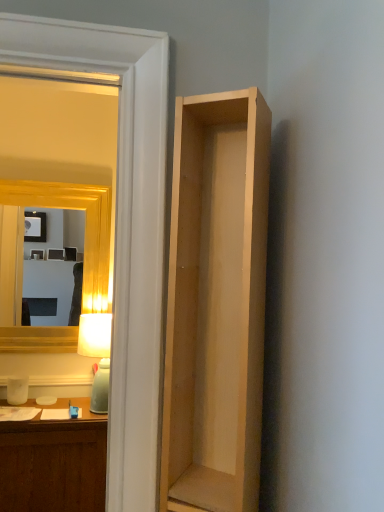
Identify the location of natural wood shelf at right. (216, 304).

From a real-world perspective, is matte white lamp at left under natural wood shelf at right?

Yes, from a real-world perspective, matte white lamp at left is below natural wood shelf at right.

Is the position of matte white lamp at left more distant than that of natural wood shelf at right?

Yes, matte white lamp at left is further from the camera.

Find the location of a particular element. Image resolution: width=384 pixels, height=512 pixels. cabinetry in front of the matte white lamp at left is located at coordinates (216, 304).

Which of these two, matte white lamp at left or natural wood shelf at right, is wider?

matte white lamp at left is wider.

From the image's perspective, is matte white lamp at left located above transparent glass door at upper left?

No, from the image's perspective, matte white lamp at left is not over transparent glass door at upper left.

Is point (107, 339) positioned after point (130, 349)?

Yes, it is behind point (130, 349).

Considering the relative sizes of matte white lamp at left and transparent glass door at upper left in the image provided, is matte white lamp at left bigger than transparent glass door at upper left?

No.

From their relative heights in the image, would you say matte white lamp at left is taller or shorter than transparent glass door at upper left?

Considering their sizes, matte white lamp at left has less height than transparent glass door at upper left.

From the image's perspective, is natural wood shelf at right below gold wooden mirror at upper left?

Indeed, from the image's perspective, natural wood shelf at right is shown beneath gold wooden mirror at upper left.

In the scene shown: From a real-world perspective, who is located lower, natural wood shelf at right or gold wooden mirror at upper left?

natural wood shelf at right, from a real-world perspective.

Considering the sizes of natural wood shelf at right and gold wooden mirror at upper left in the image, is natural wood shelf at right taller or shorter than gold wooden mirror at upper left?

natural wood shelf at right is shorter than gold wooden mirror at upper left.

Identify the location of mirror located above the natural wood shelf at right (from the image's perspective). click(56, 191).

Would you say matte white lamp at left is inside or outside gold wooden mirror at upper left?

matte white lamp at left lies outside gold wooden mirror at upper left.

Is matte white lamp at left taller than gold wooden mirror at upper left?

In fact, matte white lamp at left may be shorter than gold wooden mirror at upper left.

Is matte white lamp at left to the right of gold wooden mirror at upper left from the viewer's perspective?

Yes, matte white lamp at left is to the right of gold wooden mirror at upper left.

From a real-world perspective, which is physically above, gold wooden mirror at upper left or matte white lamp at left?

gold wooden mirror at upper left, from a real-world perspective.

Where is `mirror lying behind the matte white lamp at left`? The width and height of the screenshot is (384, 512). mirror lying behind the matte white lamp at left is located at coordinates (56, 191).

Does gold wooden mirror at upper left touch matte white lamp at left?

gold wooden mirror at upper left and matte white lamp at left are not in contact.

Which object is further away from the camera taking this photo, gold wooden mirror at upper left or matte white lamp at left?

Positioned behind is gold wooden mirror at upper left.

Is transparent glass door at upper left not near matte white lamp at left?

Yes, transparent glass door at upper left and matte white lamp at left are quite far apart.

From a real-world perspective, which is physically above, transparent glass door at upper left or matte white lamp at left?

transparent glass door at upper left, from a real-world perspective.

Which is more distant, (131, 390) or (91, 328)?

The point (91, 328) is farther from the camera.

Would you say transparent glass door at upper left is inside or outside natural wood shelf at right?

transparent glass door at upper left is not enclosed by natural wood shelf at right.

Does transparent glass door at upper left have a greater height compared to natural wood shelf at right?

Yes, transparent glass door at upper left is taller than natural wood shelf at right.

Consider the image. In terms of width, does transparent glass door at upper left look wider or thinner when compared to natural wood shelf at right?

In the image, transparent glass door at upper left appears to be more narrow than natural wood shelf at right.

There is a matte white lamp at left. Identify the location of cabinetry above it (from a real-world perspective). click(x=216, y=304).

The width and height of the screenshot is (384, 512). I want to click on glass door located above the matte white lamp at left (from the image's perspective), so click(x=122, y=225).

From the picture: Looking at the image, which one is located further to natural wood shelf at right, matte white lamp at left or transparent glass door at upper left?

The object further to natural wood shelf at right is matte white lamp at left.

When comparing their distances from transparent glass door at upper left, does natural wood shelf at right or gold wooden mirror at upper left seem closer?

Among the two, natural wood shelf at right is located nearer to transparent glass door at upper left.

Consider the image. When comparing their distances from gold wooden mirror at upper left, does natural wood shelf at right or matte white lamp at left seem further?

natural wood shelf at right is further to gold wooden mirror at upper left.

In the scene shown: Based on their spatial positions, is gold wooden mirror at upper left or transparent glass door at upper left closer to matte white lamp at left?

gold wooden mirror at upper left is positioned closer to the anchor matte white lamp at left.

Estimate the real-world distances between objects in this image. Which object is further from gold wooden mirror at upper left, matte white lamp at left or natural wood shelf at right?

The object further to gold wooden mirror at upper left is natural wood shelf at right.

From the image, which object appears to be nearer to transparent glass door at upper left, natural wood shelf at right or matte white lamp at left?

Among the two, natural wood shelf at right is located nearer to transparent glass door at upper left.

From the image, which object appears to be farther from natural wood shelf at right, gold wooden mirror at upper left or matte white lamp at left?

Among the two, gold wooden mirror at upper left is located further to natural wood shelf at right.

Based on their spatial positions, is transparent glass door at upper left or natural wood shelf at right further from gold wooden mirror at upper left?

natural wood shelf at right is further to gold wooden mirror at upper left.

Where is `glass door located between natural wood shelf at right and matte white lamp at left in the depth direction`? This screenshot has width=384, height=512. glass door located between natural wood shelf at right and matte white lamp at left in the depth direction is located at coordinates (122, 225).

The height and width of the screenshot is (512, 384). In order to click on lamp located between natural wood shelf at right and gold wooden mirror at upper left in the depth direction in this screenshot , I will do `click(97, 355)`.

The image size is (384, 512). What are the coordinates of `lamp between transparent glass door at upper left and gold wooden mirror at upper left in the front-back direction` in the screenshot? It's located at (97, 355).

In order to click on glass door between natural wood shelf at right and gold wooden mirror at upper left along the z-axis in this screenshot , I will do `click(122, 225)`.